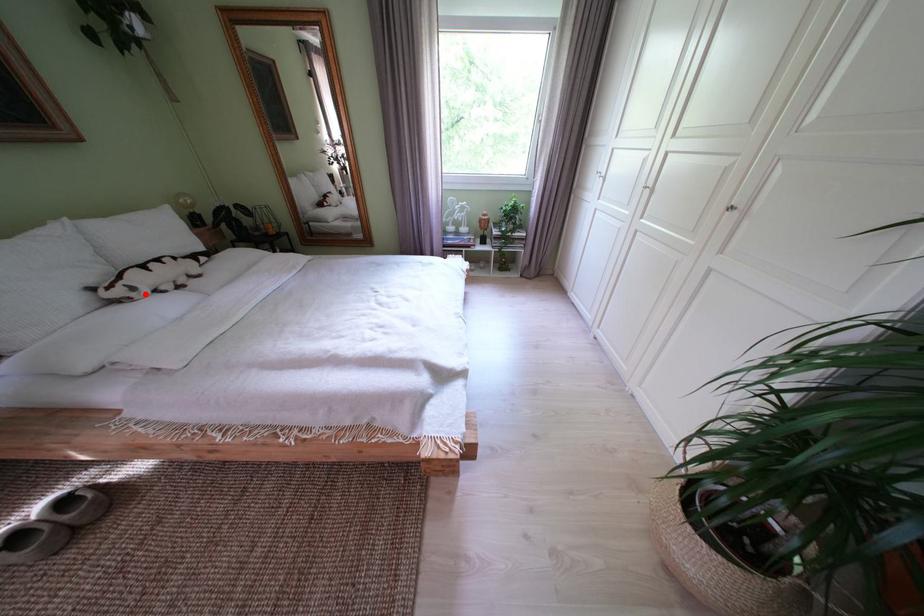
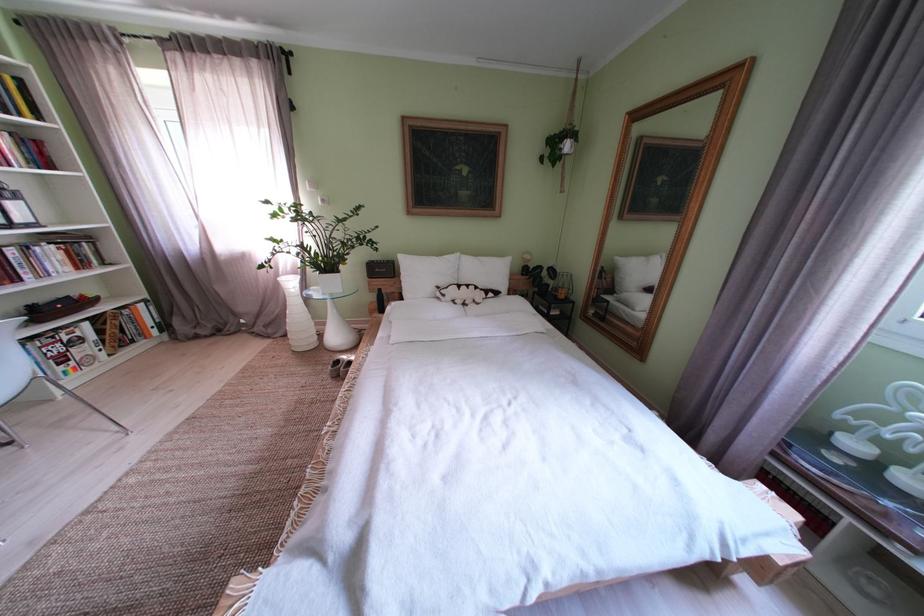
Where in the second image is the point corresponding to the highlighted location from the first image?

(455, 301)